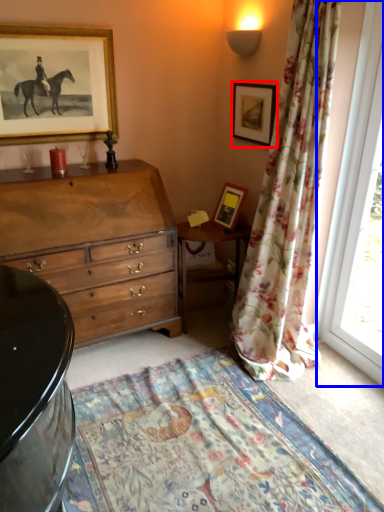
Question: Which object appears farthest to the camera in this image, picture frame (highlighted by a red box) or window (highlighted by a blue box)?

Choices:
 (A) picture frame
 (B) window

Answer: (A)